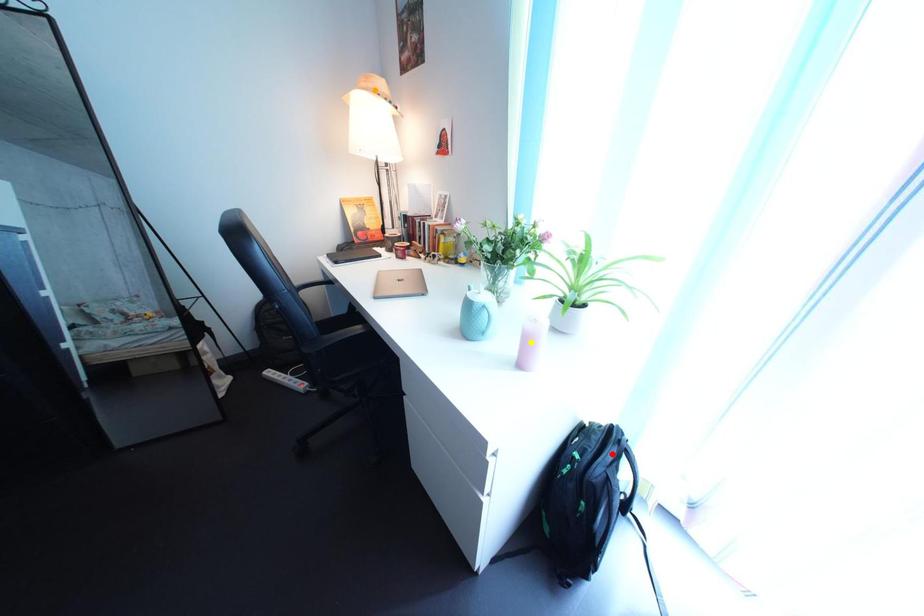
Order these from nearest to farthest:
yellow point, orange point, red point

yellow point, red point, orange point